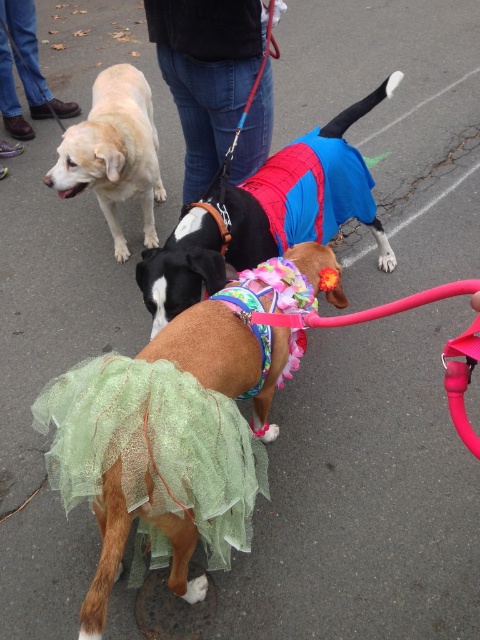
Question: Can you confirm if green tulle ballet skirt at center is bigger than shiny blue coat at center?

Choices:
 (A) no
 (B) yes

Answer: (A)

Question: Is jeans at center bigger than brushed leather shoes at lower left?

Choices:
 (A) yes
 (B) no

Answer: (B)

Question: Is green tulle skirt at center behind jeans at center?

Choices:
 (A) yes
 (B) no

Answer: (B)

Question: Among these points, which one is farthest from the camera?

Choices:
 (A) (201, 291)
 (B) (151, 145)
 (C) (69, 372)
 (D) (79, 483)

Answer: (B)

Question: Estimate the real-world distances between objects in this image. Which object is farther from the brushed leather shoes at lower left?

Choices:
 (A) green tulle ballet skirt at center
 (B) shiny blue coat at center

Answer: (A)

Question: Based on their relative distances, which object is nearer to the green tulle ballet skirt at center?

Choices:
 (A) matte yellow dog at left
 (B) green tulle skirt at center

Answer: (B)